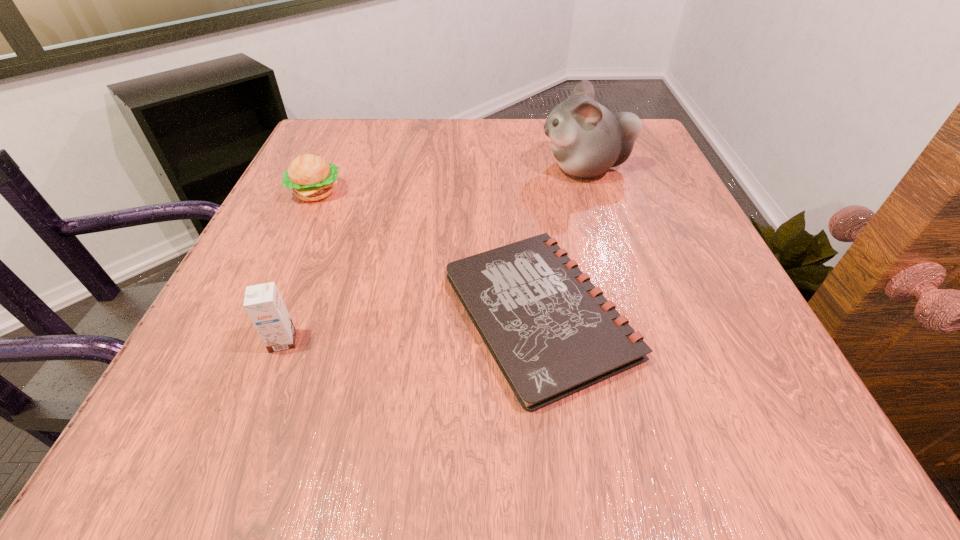
The width and height of the screenshot is (960, 540). In order to click on object that is positioned at the far edge in this screenshot , I will do `click(587, 140)`.

Locate an element on the screen. object located at the near edge is located at coordinates (552, 333).

This screenshot has height=540, width=960. Find the location of `chocolate milk present at the left edge`. chocolate milk present at the left edge is located at coordinates (263, 303).

The width and height of the screenshot is (960, 540). I want to click on hamburger located at the left edge, so click(311, 178).

You are a GUI agent. You are given a task and a screenshot of the screen. Output one action in this format:
    pyautogui.click(x=<x>, y=<y>)
    Task: Click on the object situated at the right edge
    This screenshot has width=960, height=540.
    Given the screenshot: What is the action you would take?
    pyautogui.click(x=587, y=140)

You are a GUI agent. You are given a task and a screenshot of the screen. Output one action in this format:
    pyautogui.click(x=<x>, y=<y>)
    Task: Click on the object positioned at the far right corner
    Image resolution: width=960 pixels, height=540 pixels.
    Given the screenshot: What is the action you would take?
    pyautogui.click(x=587, y=140)

Identify the location of vacant point at the far edge. The image size is (960, 540). (396, 166).

Locate an element on the screen. The image size is (960, 540). vacant space at the near edge of the desktop is located at coordinates (570, 465).

The width and height of the screenshot is (960, 540). In the image, there is a desktop. Find the location of `vacant space at the left edge`. vacant space at the left edge is located at coordinates (281, 263).

You are a GUI agent. You are given a task and a screenshot of the screen. Output one action in this format:
    pyautogui.click(x=<x>, y=<y>)
    Task: Click on the blank space at the right edge of the desktop
    This screenshot has width=960, height=540.
    Given the screenshot: What is the action you would take?
    pyautogui.click(x=625, y=168)